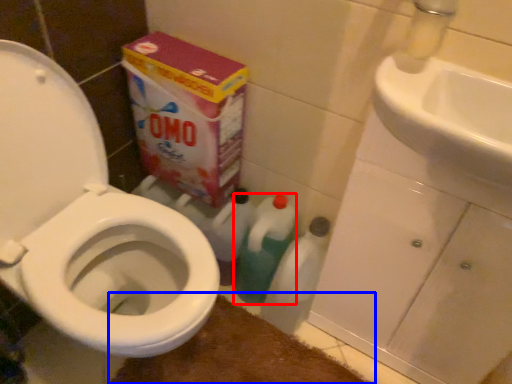
Question: Which object is closer to the camera taking this photo, cleaning product (highlighted by a red box) or bath mat (highlighted by a blue box)?

Choices:
 (A) cleaning product
 (B) bath mat

Answer: (B)